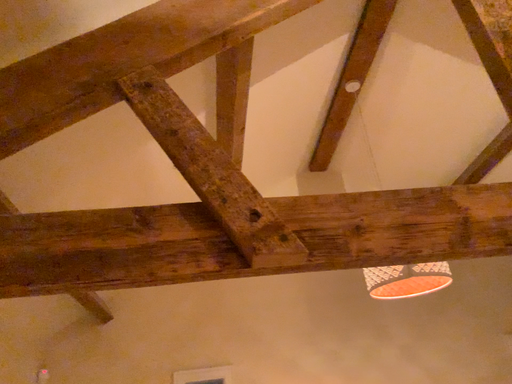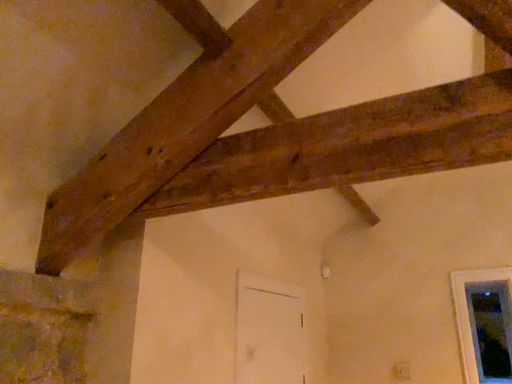
Question: Which way did the camera rotate in the video?

Choices:
 (A) rotated right
 (B) rotated left

Answer: (B)